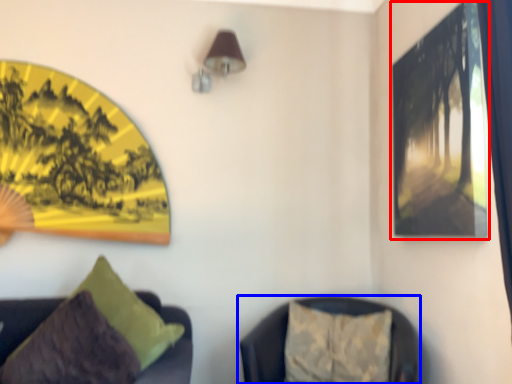
Question: Which object appears closest to the camera in this image, picture frame (highlighted by a red box) or furniture (highlighted by a blue box)?

Choices:
 (A) picture frame
 (B) furniture

Answer: (A)